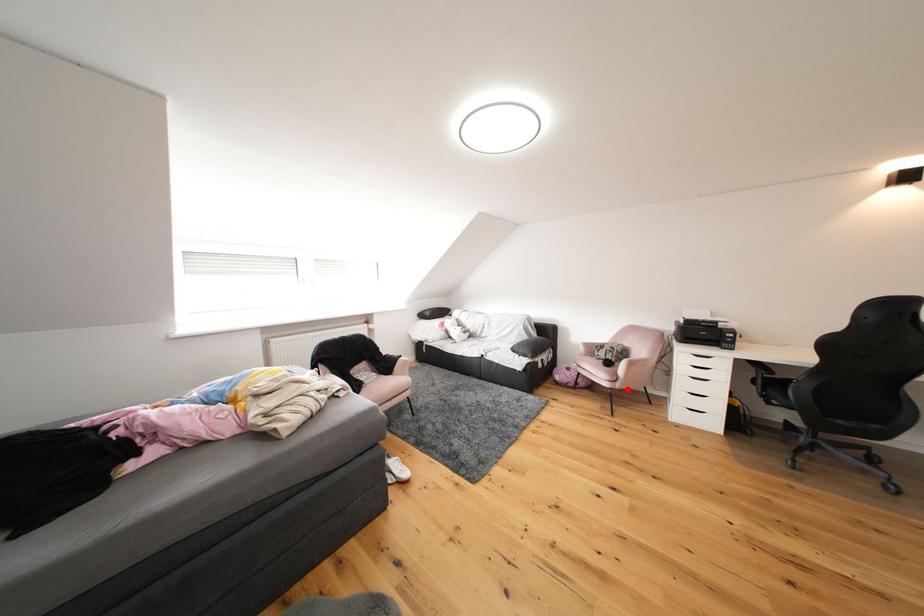
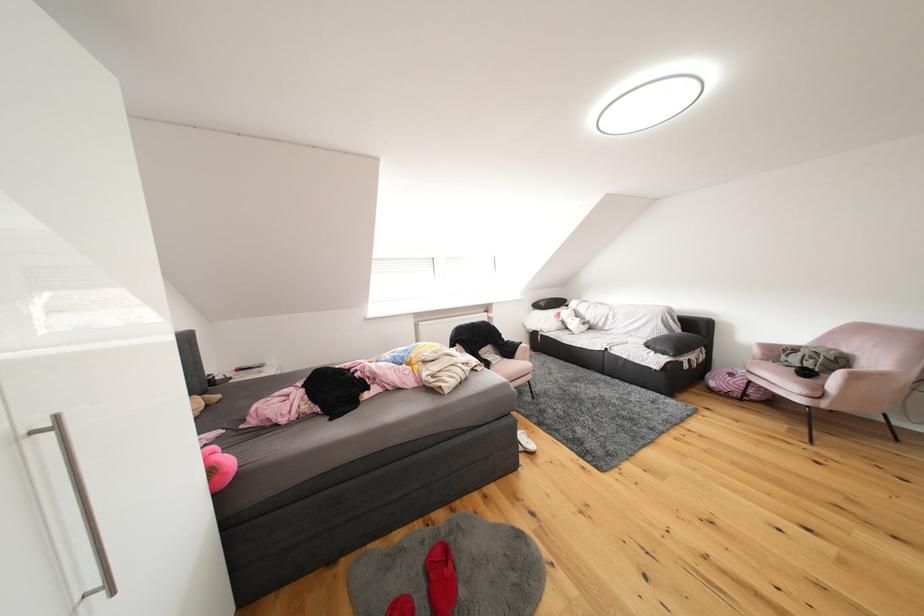
Question: I am providing you with two images of the same scene from different viewpoints. Image1 has a red point marked. In image2, the corresponding 3D location appears at what relative position? Reply with the corresponding letter.

Choices:
 (A) Closer
 (B) Farther

Answer: (A)